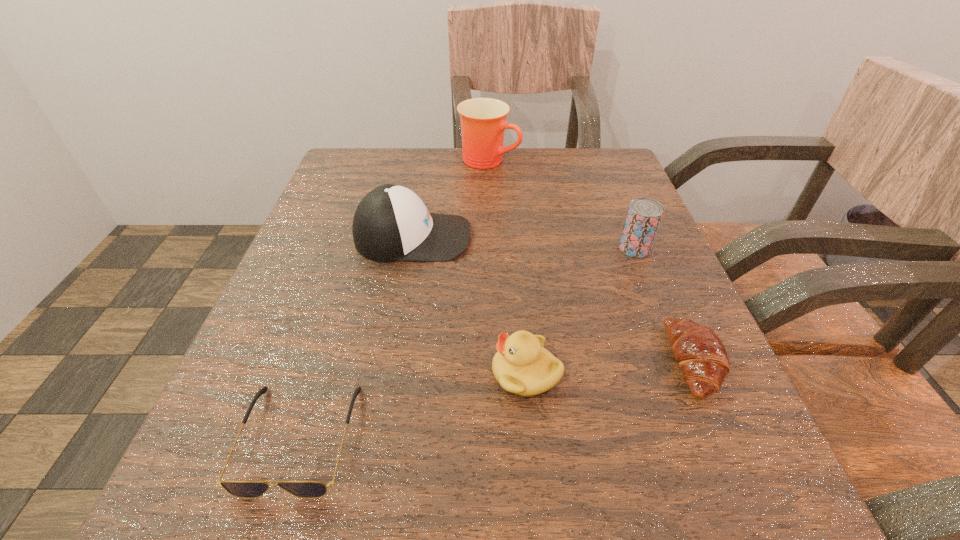
Where is `object that is at the near left corner`? The image size is (960, 540). object that is at the near left corner is located at coordinates (242, 489).

Find the location of a particular element. vacant space at the far edge is located at coordinates tap(467, 187).

Identify the location of free space at the near edge of the desktop. This screenshot has height=540, width=960. (376, 483).

Locate an element on the screen. The height and width of the screenshot is (540, 960). blank space at the left edge of the desktop is located at coordinates (336, 207).

Where is `free space at the right edge`? Image resolution: width=960 pixels, height=540 pixels. free space at the right edge is located at coordinates (708, 425).

Identify the location of blank space at the far left corner of the desktop. (338, 173).

I want to click on vacant space at the near left corner of the desktop, so [243, 456].

You are a GUI agent. You are given a task and a screenshot of the screen. Output one action in this format:
    pyautogui.click(x=<x>, y=<y>)
    Task: Click on the free space at the far right corner of the desktop
    
    Given the screenshot: What is the action you would take?
    pyautogui.click(x=564, y=165)

The width and height of the screenshot is (960, 540). Identify the location of vacant space at the near right corner of the desktop. (693, 510).

Where is `vacant region between the cap and the tallest object`? The height and width of the screenshot is (540, 960). vacant region between the cap and the tallest object is located at coordinates (451, 199).